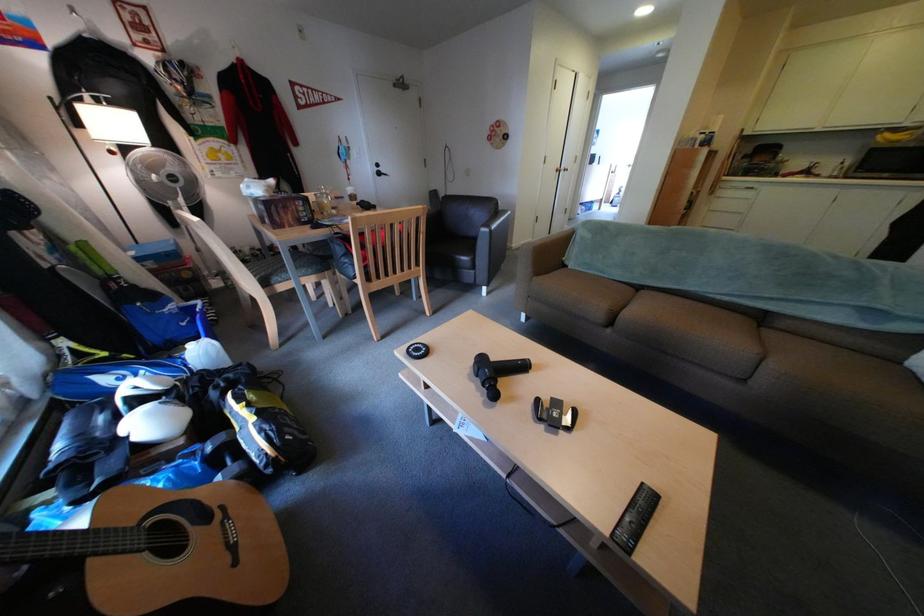
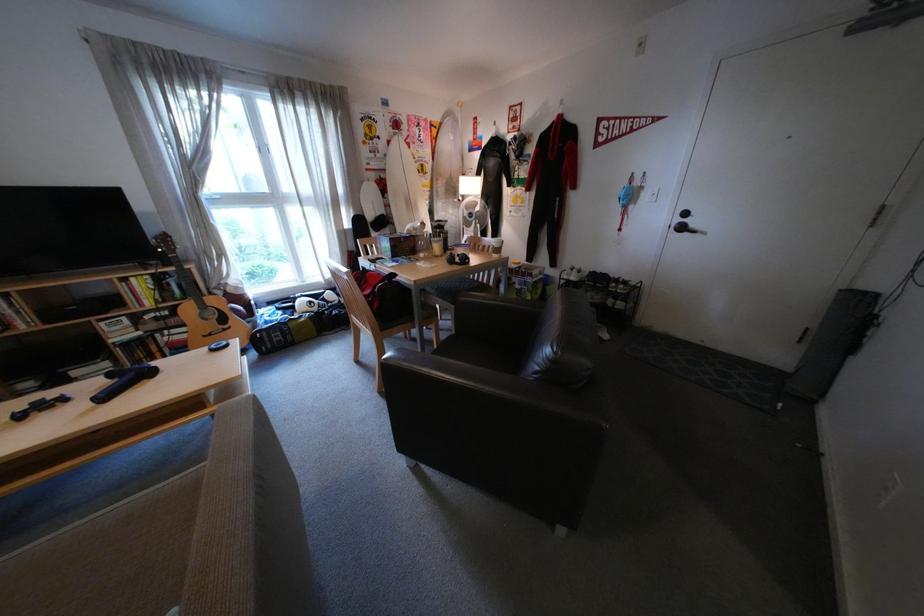
In the second image, find the point that corresponds to point (393, 175) in the first image.

(696, 229)